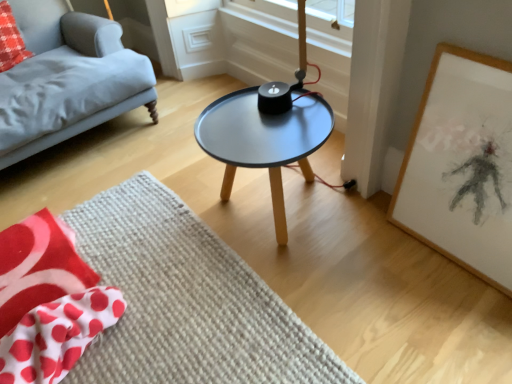
The image size is (512, 384). I want to click on vacant area that is situated to the right of matte black table at center, so click(372, 232).